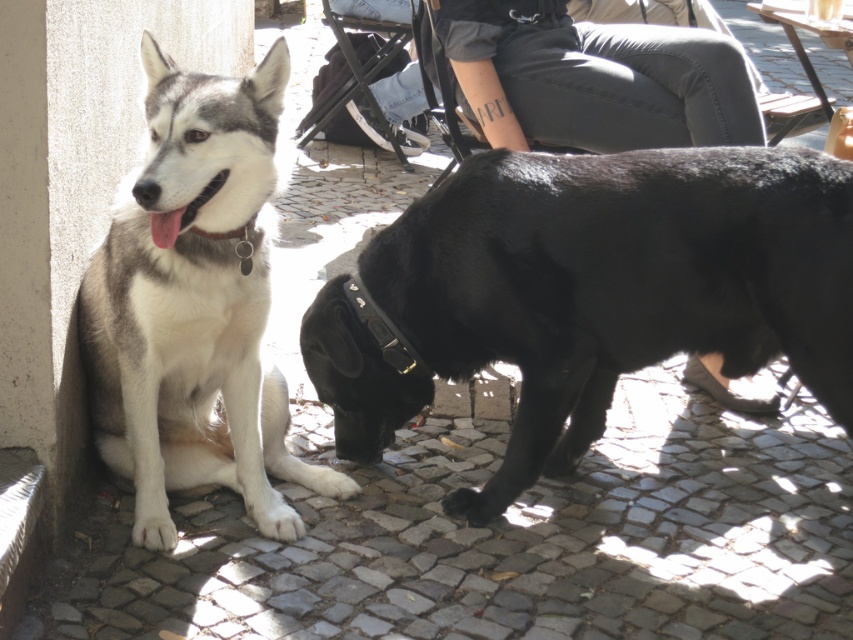
You are standing at the origin point of the coordinate system where the image is displayed. You see a point marked at coordinate point (590, 292). What object is located at that point?

The black smooth dog at lower right is located at point (590, 292).